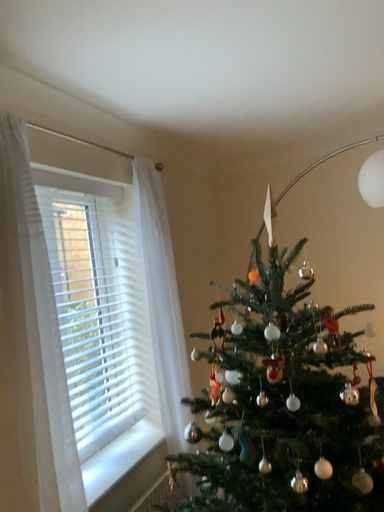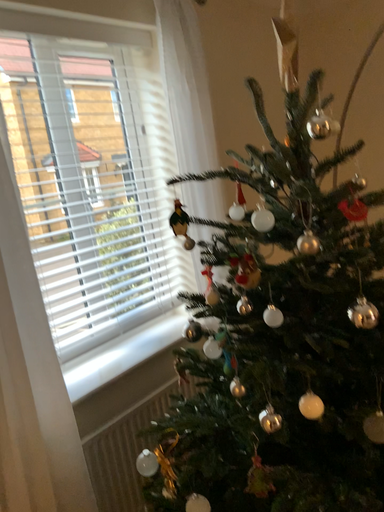
Question: How did the camera likely rotate when shooting the video?

Choices:
 (A) rotated right
 (B) rotated left

Answer: (B)